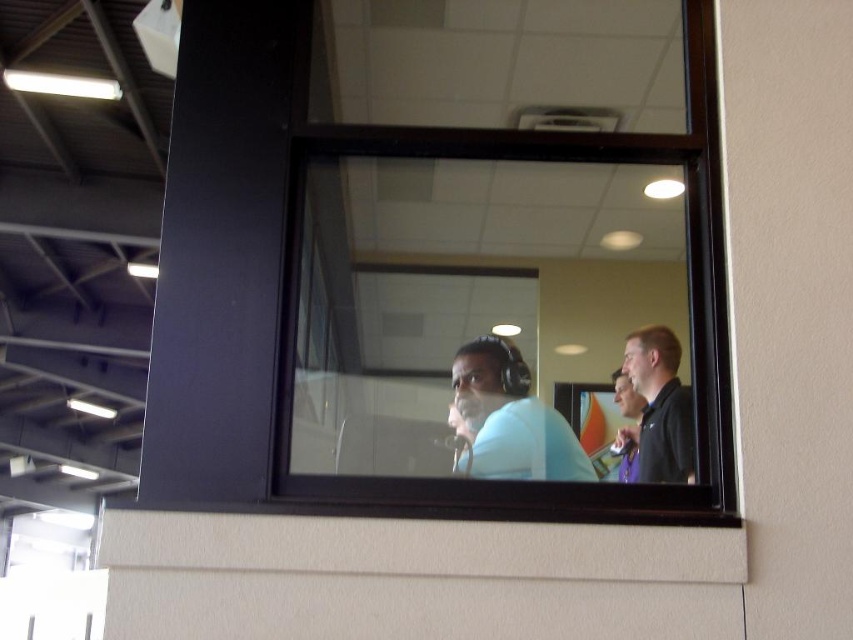
Question: Which object appears closest to the camera in this image?

Choices:
 (A) transparent glass window at center
 (B) matte blue shirt at center

Answer: (A)

Question: Is transparent glass window at center above matte blue shirt at center?

Choices:
 (A) yes
 (B) no

Answer: (A)

Question: Considering the relative positions of matte blue shirt at center and black matte shirt at right in the image provided, where is matte blue shirt at center located with respect to black matte shirt at right?

Choices:
 (A) above
 (B) below

Answer: (B)

Question: Estimate the real-world distances between objects in this image. Which object is farther from the matte blue shirt at center?

Choices:
 (A) black matte shirt at right
 (B) transparent glass window at center

Answer: (A)

Question: Does transparent glass window at center lie behind matte blue shirt at center?

Choices:
 (A) no
 (B) yes

Answer: (A)

Question: Which point is farther from the camera taking this photo?

Choices:
 (A) (529, 403)
 (B) (647, 388)

Answer: (B)